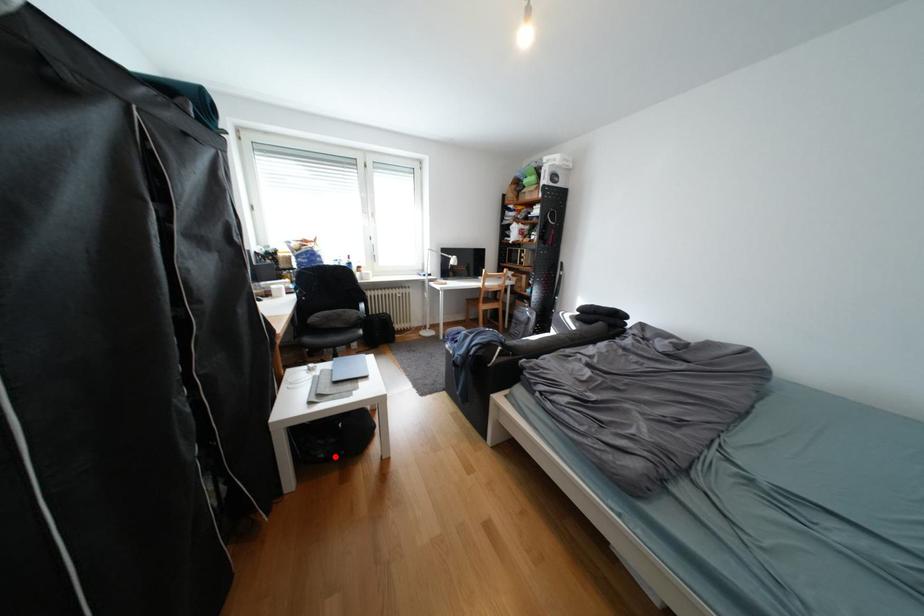
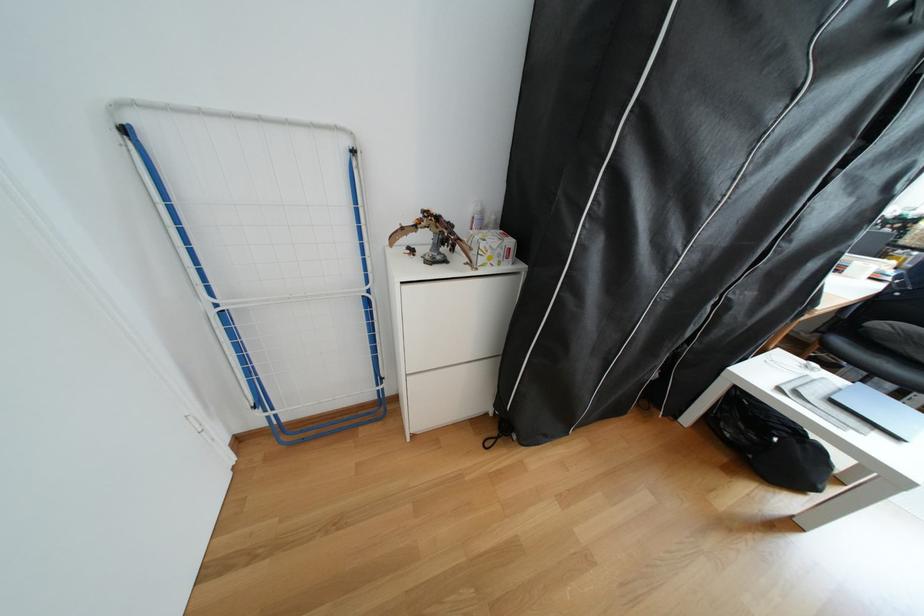
Locate, in the second image, the point that corresponds to the highlighted location in the first image.

(739, 436)